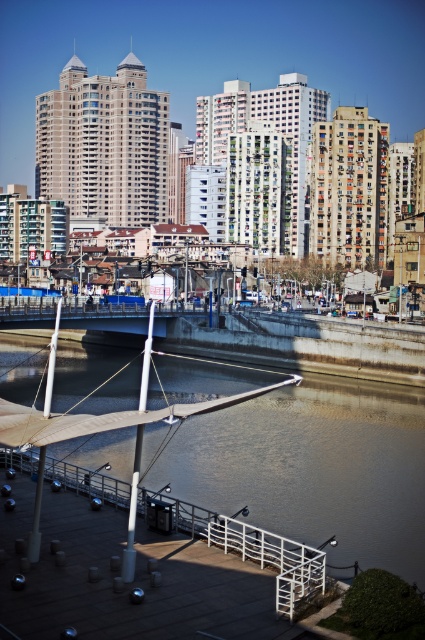
Which of these two, brown concrete river at center or white wooden dock at lower center, stands taller?

brown concrete river at center is taller.

Can you confirm if brown concrete river at center is wider than white wooden dock at lower center?

Correct, the width of brown concrete river at center exceeds that of white wooden dock at lower center.

Is point (351, 554) closer to viewer compared to point (227, 548)?

No, (351, 554) is further to viewer.

Find the location of `brown concrete river at center`. brown concrete river at center is located at coordinates (314, 467).